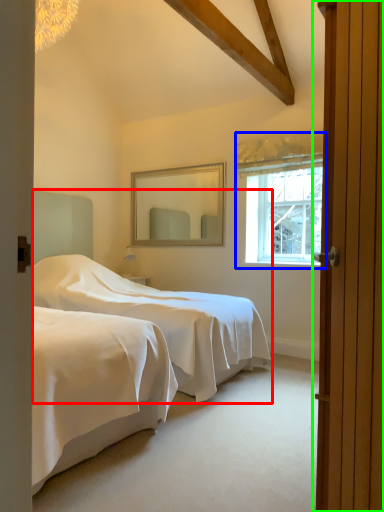
Question: Which object is positioned closest to bed (highlighted by a red box)? Select from window (highlighted by a blue box) and door (highlighted by a green box).

Choices:
 (A) window
 (B) door

Answer: (A)